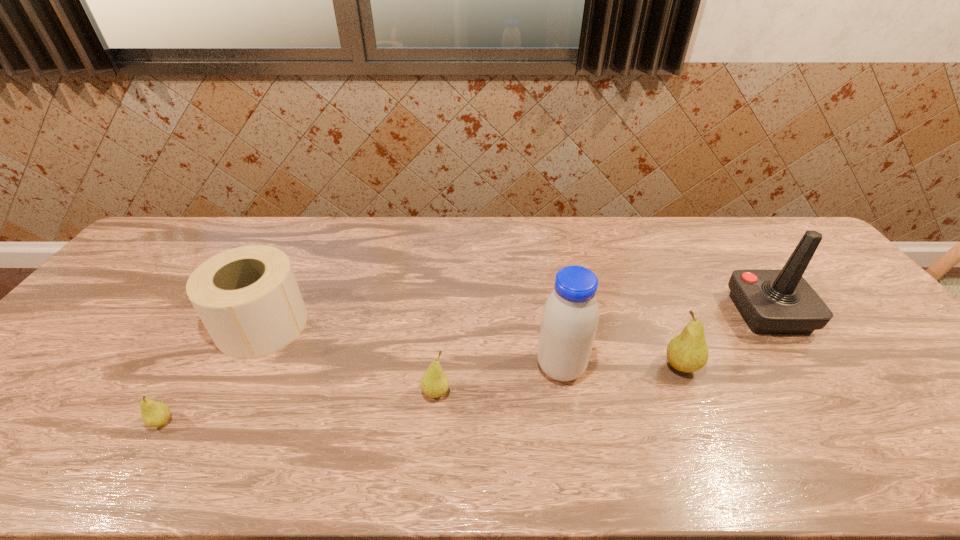
I want to click on blank space that satisfies the following two spatial constraints: 1. on the back side of the soya milk; 2. on the left side of the second object from right to left, so coord(561,367).

The height and width of the screenshot is (540, 960). Identify the location of blank space that satisfies the following two spatial constraints: 1. on the back side of the rightmost object; 2. on the right side of the shortest object. point(228,313).

The width and height of the screenshot is (960, 540). I want to click on blank area in the image that satisfies the following two spatial constraints: 1. on the back side of the second object from right to left; 2. on the left side of the shortest pear, so click(x=196, y=367).

In order to click on vacant area that satisfies the following two spatial constraints: 1. on the back side of the fourth object from left to right; 2. on the right side of the second tallest pear in this screenshot , I will do `click(439, 367)`.